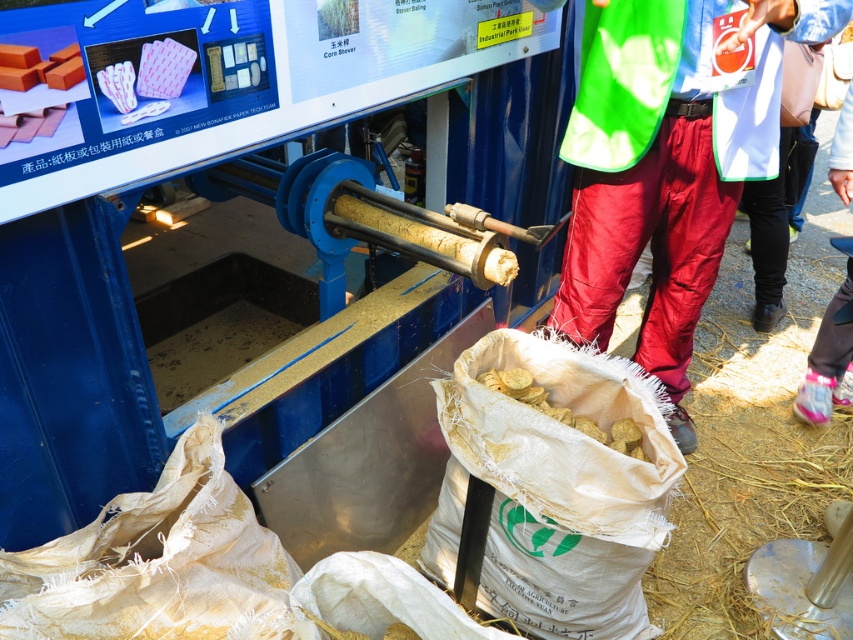
You are standing in the industrial setting shown in the image. You need to locate the red nylon pants at right. Where would you look relative to the cylindrical blue machine?

The red nylon pants at right are located at the coordinates point (x=653, y=234) in the image, which is to the right side of the cylindrical blue machine.

You are an inspector checking the industrial machine setup. You notice the red nylon pants at right and the yellow matte chips at lower center. Which object is placed above the other?

The red nylon pants at right is positioned over the yellow matte chips at lower center.